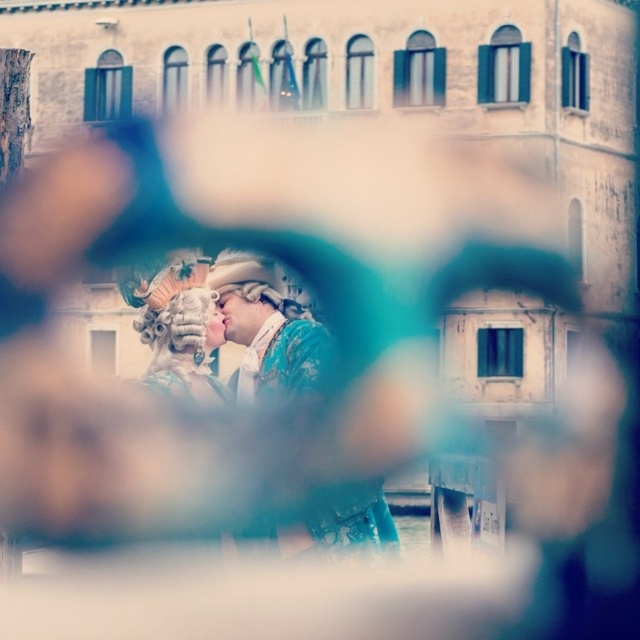
You are an artist trying to recreate this scene. You want to place the shiny gold mask at center in your painting. According to the coordinates provided, where should you position it on a standard 1024x1024 canvas?

The shiny gold mask at center should be placed at coordinates approximately (639, 639) on the 1024x1024 canvas, as the 2D location given is point (268, 326).

You are a photographer who needs to place a 15cm tall decoration on a shelf. You have two options from the scene, the shiny gold mask at center and the matte gold mask at center. Which one should you choose to ensure it fits under a 16cm height restriction?

The shiny gold mask at center is taller than the matte gold mask at center, so the matte gold mask at center is shorter and will fit under the 16cm height restriction.

You are a photographer adjusting the camera focus. You want to capture both the shiny gold mask at center and the matte gold mask at center clearly. Which mask should you focus on first to ensure the other is also in focus?

You should focus on the shiny gold mask at center first because it is in front of the matte gold mask at center, so focusing on the closer object will help keep both in focus.